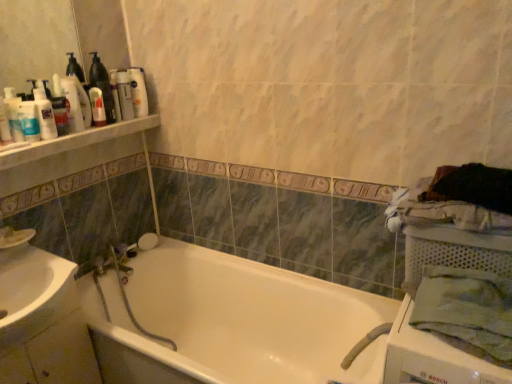
Question: Is point (489, 302) closer or farther from the camera than point (125, 94)?

Choices:
 (A) farther
 (B) closer

Answer: (B)

Question: From a real-world perspective, relative to matte white lotion at upper left, which is counted as the fifth toiletry, starting from the front, is green cotton bath towel at right vertically above or below?

Choices:
 (A) below
 (B) above

Answer: (A)

Question: Considering the real-world distances, which object is farthest from the white glossy lotion at upper left, the 2th toiletry viewed from the back?

Choices:
 (A) green cotton bath towel at right
 (B) matte white lotion at upper left, arranged as the fourth toiletry when viewed from the back
 (C) white glossy bathtub at center
 (D) white glossy sink at lower left
 (E) matte plastic bottle at upper left, positioned as the 3th toiletry in front-to-back order

Answer: (A)

Question: Estimate the real-world distances between objects in this image. Which object is closer to the matte white lotion at upper left, arranged as the fourth toiletry when viewed from the back?

Choices:
 (A) matte plastic bottle at upper left, which is the 3th toiletry from back to front
 (B) translucent plastic bottle at upper left
 (C) green cotton bath towel at right
 (D) white mesh basket at right
 (E) white glossy sink at lower left

Answer: (A)